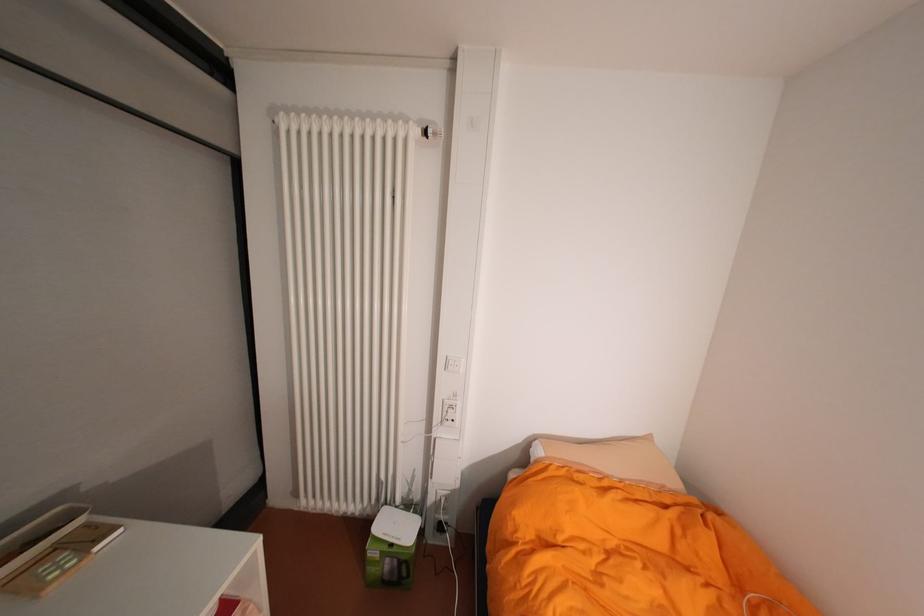
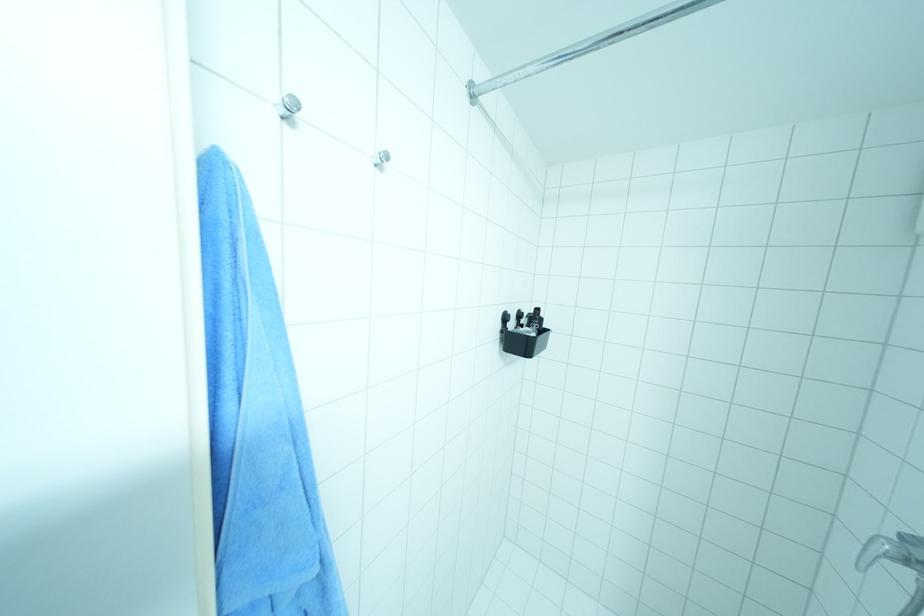
Question: I am providing you with two images of the same scene from different viewpoints. Please identify which objects are invisible in image2.

Choices:
 (A) white radiator knob
 (B) black toothbrush
 (C) shower faucet handle
 (D) white chair handle

Answer: (A)